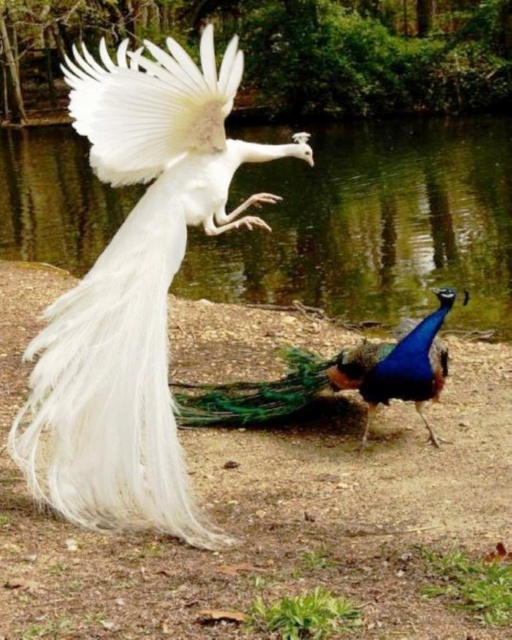
Question: Which is nearer to the white feathered peacock at center?

Choices:
 (A) blue glossy peacock at center
 (B) transparent water at center

Answer: (A)

Question: Is white feathered peacock at center closer to camera compared to blue glossy peacock at center?

Choices:
 (A) yes
 (B) no

Answer: (A)

Question: Which point is farther from the camera taking this photo?

Choices:
 (A) (396, 314)
 (B) (69, 428)
 (C) (354, 362)

Answer: (A)

Question: Which object is closer to the camera taking this photo?

Choices:
 (A) blue glossy peacock at center
 (B) white feathered peacock at center

Answer: (B)

Question: Where is white feathered peacock at center located in relation to transparent water at center in the image?

Choices:
 (A) left
 (B) right

Answer: (A)

Question: Can you confirm if white feathered peacock at center is positioned to the left of blue glossy peacock at center?

Choices:
 (A) no
 (B) yes

Answer: (B)